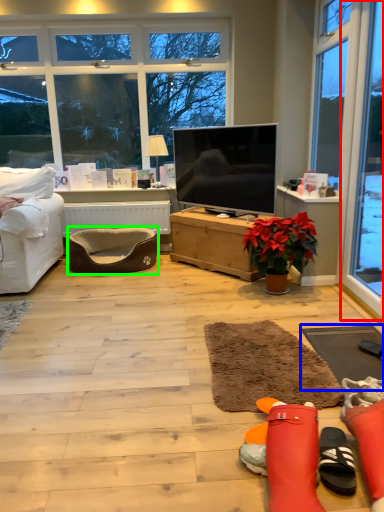
Question: Considering the real-world distances, which object is closest to window (highlighted by a red box)? flat (highlighted by a blue box) or footrest (highlighted by a green box).

Choices:
 (A) flat
 (B) footrest

Answer: (A)